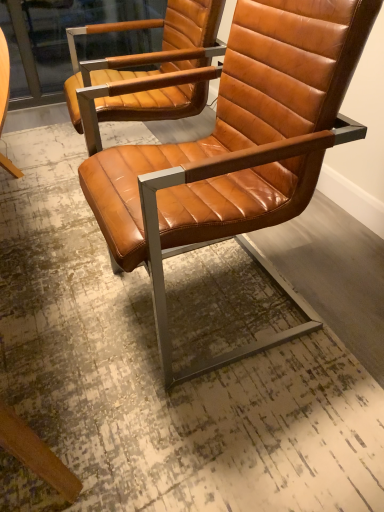
Image resolution: width=384 pixels, height=512 pixels. What do you see at coordinates (233, 146) in the screenshot? I see `cognac leather chair at center` at bounding box center [233, 146].

What are the coordinates of `cognac leather chair at center` in the screenshot? It's located at (233, 146).

Locate an element on the screen. This screenshot has height=512, width=384. cognac leather chair at center is located at coordinates (233, 146).